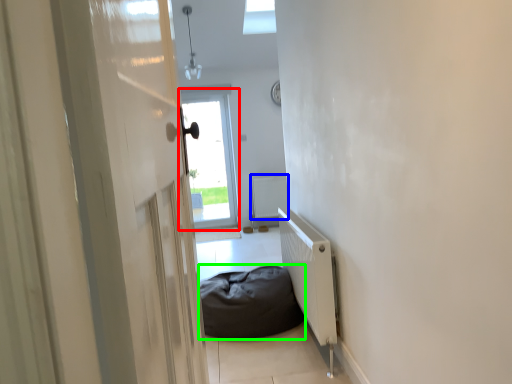
Question: Which is nearer to the window (highlighted by a red box)? radiator (highlighted by a blue box) or furniture (highlighted by a green box).

Choices:
 (A) radiator
 (B) furniture

Answer: (A)